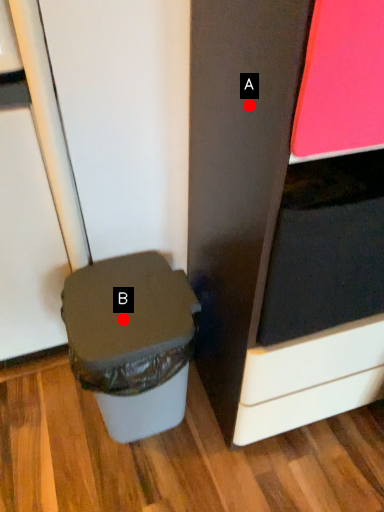
Question: Two points are circled on the image, labeled by A and B beside each circle. Which point is farther to the camera?

Choices:
 (A) A is further
 (B) B is further

Answer: (B)